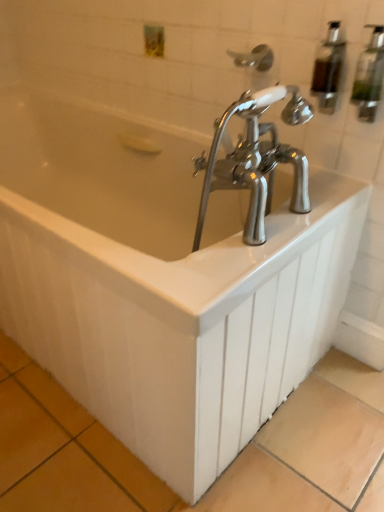
From the picture: Measure the distance between clear plastic shower head at upper center and camera.

3.39 feet.

The height and width of the screenshot is (512, 384). What do you see at coordinates (328, 69) in the screenshot?
I see `translucent plastic soap dispenser at upper right, which is the second soap dispenser in right-to-left order` at bounding box center [328, 69].

Find the location of a particular element. This screenshot has width=384, height=512. clear glass soap dispenser at upper right, the first soap dispenser from the right is located at coordinates (369, 75).

In order to face clear glass soap dispenser at upper right, placed as the second soap dispenser when sorted from left to right, should I rotate leftwards or rightwards?

You should look right and rotate roughly 22.426 degrees.

You are a GUI agent. You are given a task and a screenshot of the screen. Output one action in this format:
    pyautogui.click(x=<x>, y=<y>)
    Task: Click on the clear plastic shower head at upper center
    The image size is (384, 512).
    Given the screenshot: What is the action you would take?
    pyautogui.click(x=254, y=58)

Locate an element on the screen. The width and height of the screenshot is (384, 512). soap dispenser below the translucent plastic soap dispenser at upper right, which is the second soap dispenser in right-to-left order (from the image's perspective) is located at coordinates (369, 75).

Which is nearer, (331,49) or (365,86)?

The point (365,86) is in front.

Based on the photo, which of these two, translucent plastic soap dispenser at upper right, the first soap dispenser in the left-to-right sequence, or clear glass soap dispenser at upper right, placed as the second soap dispenser when sorted from left to right, stands shorter?

Standing shorter between the two is translucent plastic soap dispenser at upper right, the first soap dispenser in the left-to-right sequence.

From their relative heights in the image, would you say clear plastic shower head at upper center is taller or shorter than translucent plastic soap dispenser at upper right, the first soap dispenser in the left-to-right sequence?

Clearly, clear plastic shower head at upper center is shorter compared to translucent plastic soap dispenser at upper right, the first soap dispenser in the left-to-right sequence.

Which is more to the left, clear plastic shower head at upper center or translucent plastic soap dispenser at upper right, the first soap dispenser in the left-to-right sequence?

clear plastic shower head at upper center.

Considering the positions of objects clear plastic shower head at upper center and translucent plastic soap dispenser at upper right, the first soap dispenser in the left-to-right sequence, in the image provided, who is in front, clear plastic shower head at upper center or translucent plastic soap dispenser at upper right, the first soap dispenser in the left-to-right sequence,?

translucent plastic soap dispenser at upper right, the first soap dispenser in the left-to-right sequence, is in front.

Could you tell me if clear glass soap dispenser at upper right, the first soap dispenser from the right, is facing translucent plastic soap dispenser at upper right, the first soap dispenser in the left-to-right sequence?

No, clear glass soap dispenser at upper right, the first soap dispenser from the right, is not aimed at translucent plastic soap dispenser at upper right, the first soap dispenser in the left-to-right sequence.

How many degrees apart are the facing directions of clear glass soap dispenser at upper right, the first soap dispenser from the right, and translucent plastic soap dispenser at upper right, the first soap dispenser in the left-to-right sequence?

clear glass soap dispenser at upper right, the first soap dispenser from the right, and translucent plastic soap dispenser at upper right, the first soap dispenser in the left-to-right sequence, are facing 0.0106 degrees away from each other.

Is point (352, 88) closer to camera compared to point (329, 84)?

Yes, point (352, 88) is in front of point (329, 84).

Between clear glass soap dispenser at upper right, placed as the second soap dispenser when sorted from left to right, and translucent plastic soap dispenser at upper right, which is the second soap dispenser in right-to-left order, which one has smaller width?

translucent plastic soap dispenser at upper right, which is the second soap dispenser in right-to-left order, is thinner.

Does clear plastic shower head at upper center turn towards clear glass soap dispenser at upper right, the first soap dispenser from the right?

No.

Is clear plastic shower head at upper center positioned behind clear glass soap dispenser at upper right, the first soap dispenser from the right?

Yes, it is behind clear glass soap dispenser at upper right, the first soap dispenser from the right.

From the image's perspective, is clear plastic shower head at upper center on clear glass soap dispenser at upper right, the first soap dispenser from the right?

Yes, from the image's perspective, clear plastic shower head at upper center is over clear glass soap dispenser at upper right, the first soap dispenser from the right.

Is point (383, 63) farther from viewer compared to point (264, 44)?

No, (383, 63) is closer to viewer.

Considering the relative sizes of clear glass soap dispenser at upper right, placed as the second soap dispenser when sorted from left to right, and clear plastic shower head at upper center in the image provided, is clear glass soap dispenser at upper right, placed as the second soap dispenser when sorted from left to right, thinner than clear plastic shower head at upper center?

Indeed, clear glass soap dispenser at upper right, placed as the second soap dispenser when sorted from left to right, has a lesser width compared to clear plastic shower head at upper center.

Can you confirm if translucent plastic soap dispenser at upper right, which is the second soap dispenser in right-to-left order, is wider than clear plastic shower head at upper center?

No, translucent plastic soap dispenser at upper right, which is the second soap dispenser in right-to-left order, is not wider than clear plastic shower head at upper center.

Consider the image. From the image's perspective, is translucent plastic soap dispenser at upper right, which is the second soap dispenser in right-to-left order, on top of clear plastic shower head at upper center?

No, from the image's perspective, translucent plastic soap dispenser at upper right, which is the second soap dispenser in right-to-left order, is not above clear plastic shower head at upper center.

Considering the sizes of objects translucent plastic soap dispenser at upper right, which is the second soap dispenser in right-to-left order, and clear plastic shower head at upper center in the image provided, who is bigger, translucent plastic soap dispenser at upper right, which is the second soap dispenser in right-to-left order, or clear plastic shower head at upper center?

clear plastic shower head at upper center is bigger.

Is translucent plastic soap dispenser at upper right, which is the second soap dispenser in right-to-left order, positioned with its back to clear plastic shower head at upper center?

No, translucent plastic soap dispenser at upper right, which is the second soap dispenser in right-to-left order, is not facing away from clear plastic shower head at upper center.

This screenshot has width=384, height=512. What are the coordinates of `soap dispenser in front of the translucent plastic soap dispenser at upper right, the first soap dispenser in the left-to-right sequence` in the screenshot? It's located at (369, 75).

What are the coordinates of `shower above the translucent plastic soap dispenser at upper right, the first soap dispenser in the left-to-right sequence (from the image's perspective)` in the screenshot? It's located at (254, 58).

When comparing their distances from translucent plastic soap dispenser at upper right, which is the second soap dispenser in right-to-left order, does clear plastic shower head at upper center or clear glass soap dispenser at upper right, the first soap dispenser from the right, seem further?

Based on the image, clear plastic shower head at upper center appears to be further to translucent plastic soap dispenser at upper right, which is the second soap dispenser in right-to-left order.

Which object lies nearer to the anchor point clear plastic shower head at upper center, translucent plastic soap dispenser at upper right, which is the second soap dispenser in right-to-left order, or clear glass soap dispenser at upper right, the first soap dispenser from the right?

translucent plastic soap dispenser at upper right, which is the second soap dispenser in right-to-left order, is closer to clear plastic shower head at upper center.

From the image, which object appears to be nearer to clear plastic shower head at upper center, clear glass soap dispenser at upper right, placed as the second soap dispenser when sorted from left to right, or translucent plastic soap dispenser at upper right, which is the second soap dispenser in right-to-left order?

Among the two, translucent plastic soap dispenser at upper right, which is the second soap dispenser in right-to-left order, is located nearer to clear plastic shower head at upper center.

Estimate the real-world distances between objects in this image. Which object is further from translucent plastic soap dispenser at upper right, the first soap dispenser in the left-to-right sequence, clear glass soap dispenser at upper right, placed as the second soap dispenser when sorted from left to right, or clear plastic shower head at upper center?

Based on the image, clear plastic shower head at upper center appears to be further to translucent plastic soap dispenser at upper right, the first soap dispenser in the left-to-right sequence.

From the image, which object appears to be farther from clear glass soap dispenser at upper right, the first soap dispenser from the right, translucent plastic soap dispenser at upper right, which is the second soap dispenser in right-to-left order, or clear plastic shower head at upper center?

clear plastic shower head at upper center lies further to clear glass soap dispenser at upper right, the first soap dispenser from the right, than the other object.

From the image, which object appears to be farther from clear glass soap dispenser at upper right, placed as the second soap dispenser when sorted from left to right, clear plastic shower head at upper center or translucent plastic soap dispenser at upper right, the first soap dispenser in the left-to-right sequence?

clear plastic shower head at upper center is further to clear glass soap dispenser at upper right, placed as the second soap dispenser when sorted from left to right.

Find the location of a particular element. soap dispenser located between clear plastic shower head at upper center and clear glass soap dispenser at upper right, the first soap dispenser from the right, in the left-right direction is located at coordinates (328, 69).